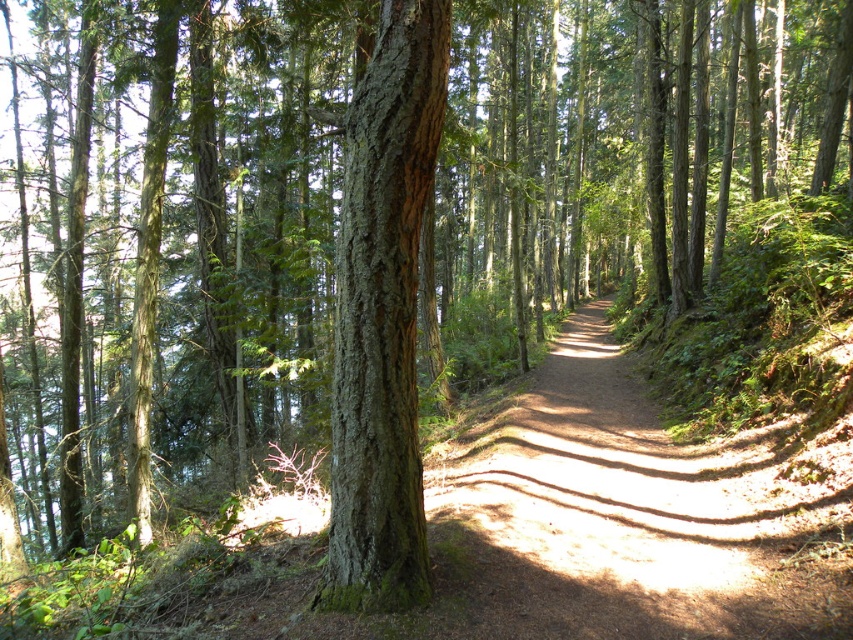
Is point (602, 403) closer to camera compared to point (387, 500)?

No, it is not.

Is dirt path at center above green rough bark tree at center?

Actually, dirt path at center is below green rough bark tree at center.

Is point (601, 461) closer to camera compared to point (408, 365)?

No, (601, 461) is further to viewer.

Where is `dirt path at center`? dirt path at center is located at coordinates (614, 518).